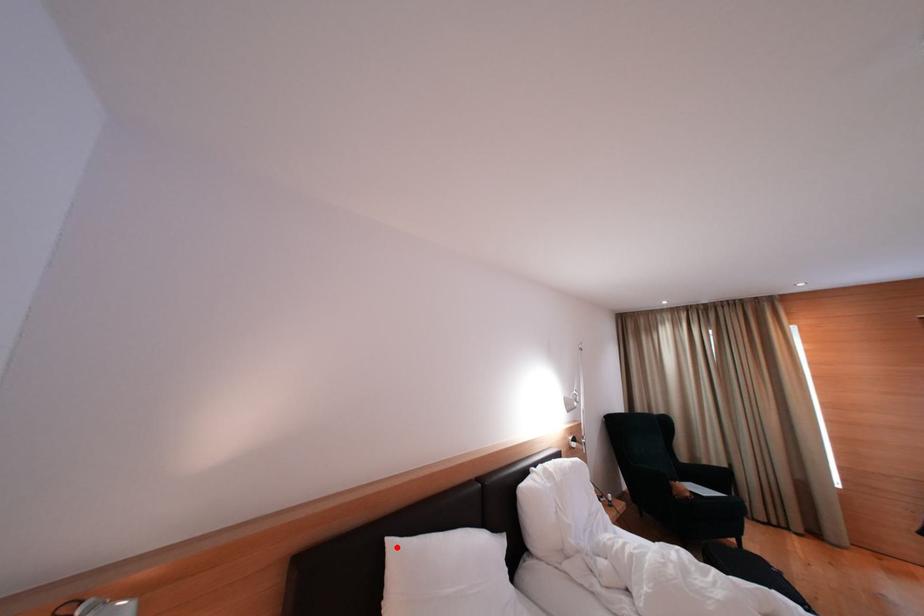
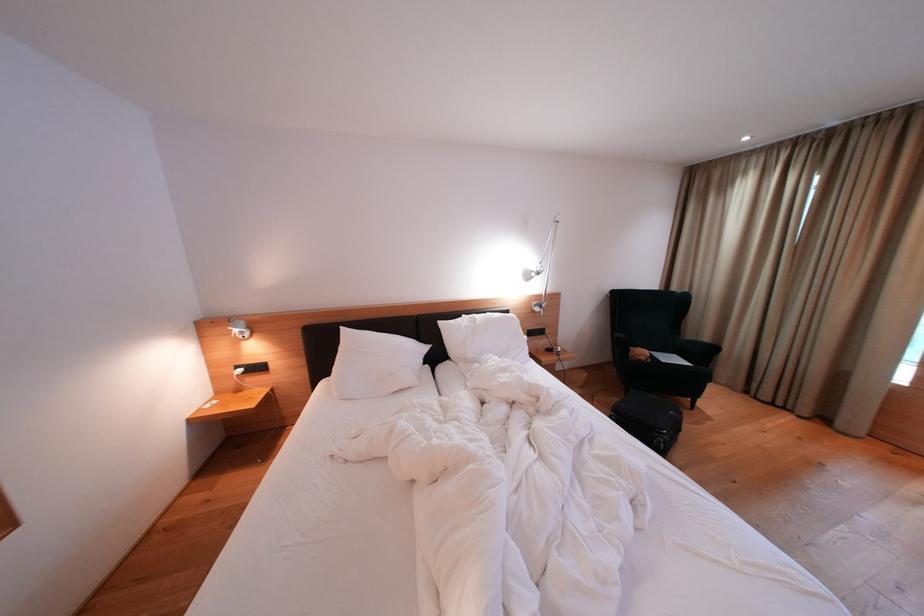
Where in the second image is the point corresponding to the highlighted location from the first image?

(349, 333)